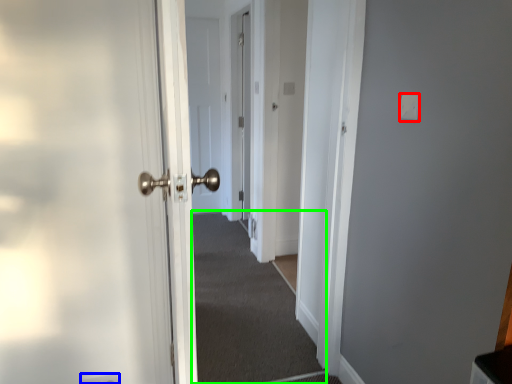
Question: Considering the real-world distances, which object is farthest from light switch (highlighted by a red box)? electric outlet (highlighted by a blue box) or corridor (highlighted by a green box)?

Choices:
 (A) electric outlet
 (B) corridor

Answer: (B)